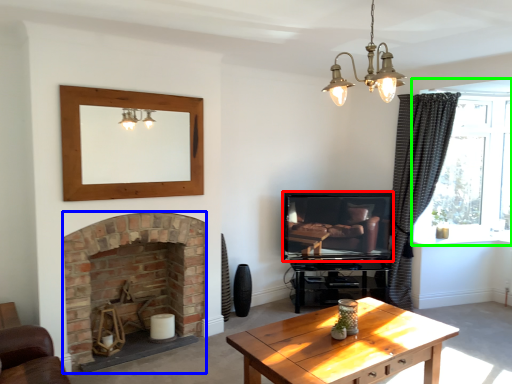
Question: Which object is the closest to the television (highlighted by a red box)? Choose among these: fireplace (highlighted by a blue box) or window (highlighted by a green box).

Choices:
 (A) fireplace
 (B) window

Answer: (B)